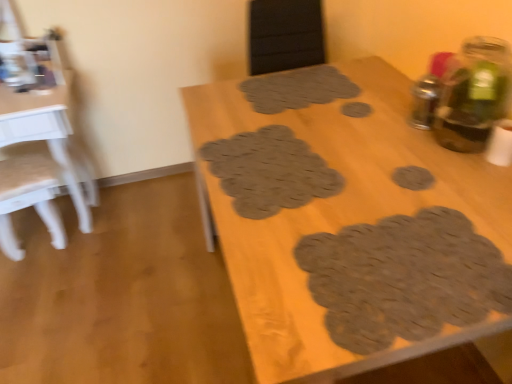
This screenshot has width=512, height=384. Find the location of `vacant space that's between metallic silver bottle at upper right, the second bottle viewed from the front, and brown felt coaster at center, acting as the 2th footprint starting from the top`. vacant space that's between metallic silver bottle at upper right, the second bottle viewed from the front, and brown felt coaster at center, acting as the 2th footprint starting from the top is located at coordinates (389, 120).